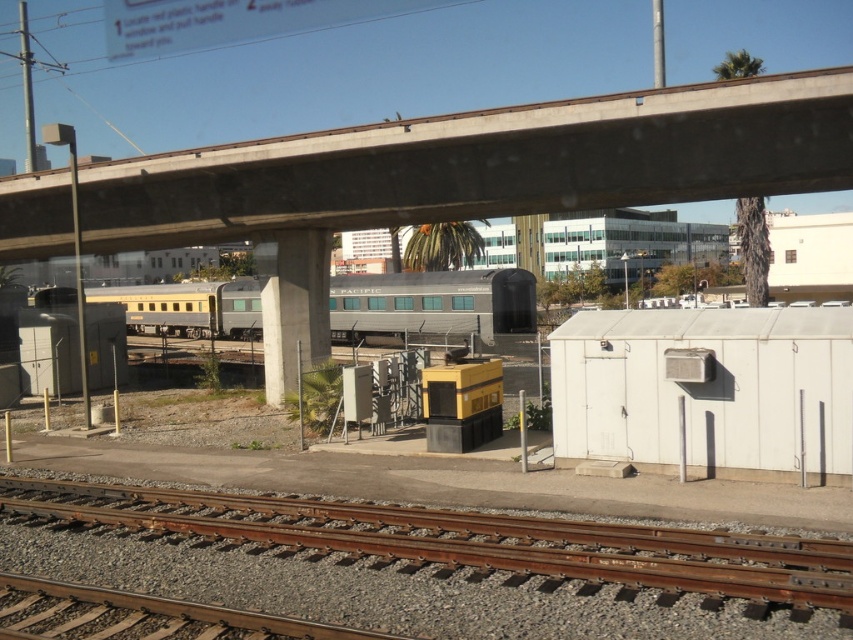
Question: Which point is farther from the camera taking this photo?

Choices:
 (A) click(468, 525)
 (B) click(146, 291)

Answer: (B)

Question: Which is farther from the metallic gray train car at center?

Choices:
 (A) concrete at upper center
 (B) brown wooden track at lower center

Answer: (B)

Question: Can you confirm if concrete at upper center is wider than brown wooden track at lower center?

Choices:
 (A) no
 (B) yes

Answer: (B)

Question: Can you confirm if concrete at upper center is wider than metallic gray train car at center?

Choices:
 (A) yes
 (B) no

Answer: (B)

Question: Based on their relative distances, which object is nearer to the brown wooden track at lower center?

Choices:
 (A) metallic gray train car at center
 (B) concrete at upper center

Answer: (B)

Question: Is brown wooden track at lower center to the right of metallic gray train car at center from the viewer's perspective?

Choices:
 (A) yes
 (B) no

Answer: (A)